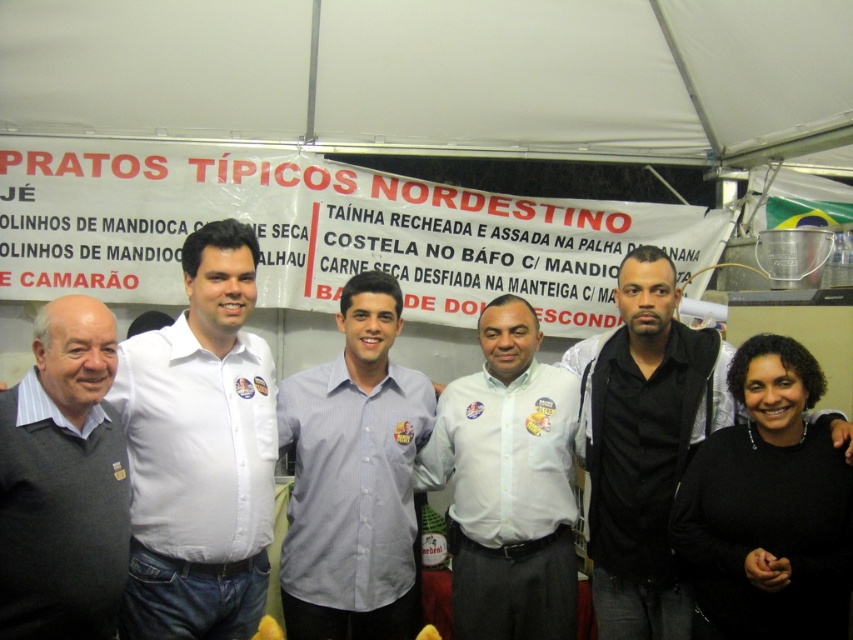
Question: Is white fabric canopy at upper center thinner than gray sweater at left?

Choices:
 (A) no
 (B) yes

Answer: (A)

Question: Which of the following is the closest to the observer?

Choices:
 (A) (496, 484)
 (B) (18, 420)

Answer: (B)

Question: Estimate the real-world distances between objects in this image. Which object is closer to the light blue striped shirt at center?

Choices:
 (A) gray sweater at left
 (B) black matte shirt at right

Answer: (A)

Question: Which point is closer to the camera?

Choices:
 (A) (508, 397)
 (B) (70, 552)
 (C) (798, 483)

Answer: (B)

Question: Is white fabric canopy at upper center to the right of white matte shirt at center from the viewer's perspective?

Choices:
 (A) no
 (B) yes

Answer: (B)

Question: Is the position of white matte shirt at center more distant than that of gray sweater at left?

Choices:
 (A) yes
 (B) no

Answer: (A)